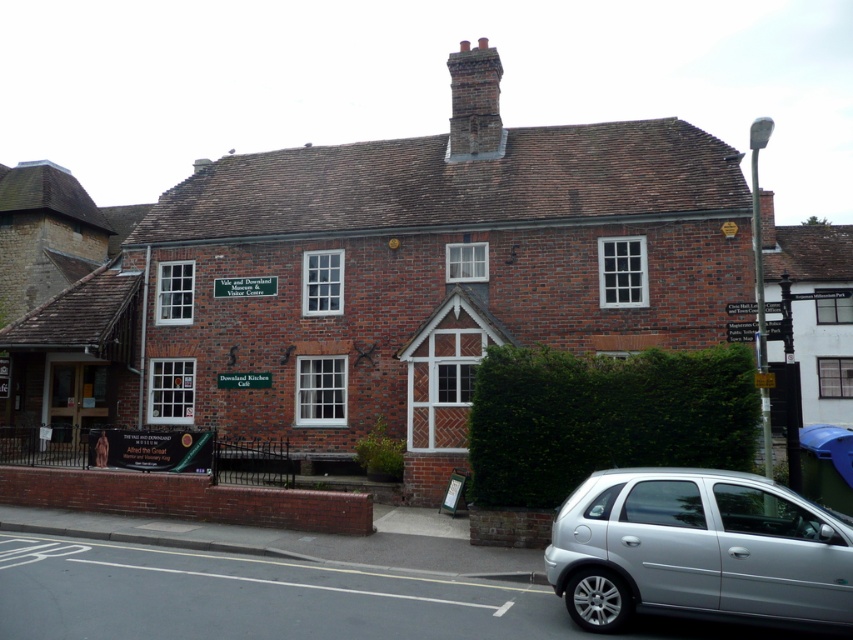
Question: Which point is closer to the camera?

Choices:
 (A) silver metallic hatchback at lower right
 (B) green leafy hedge at lower right

Answer: (A)

Question: Is the position of silver metallic hatchback at lower right less distant than that of green leafy hedge at lower right?

Choices:
 (A) no
 (B) yes

Answer: (B)

Question: Does green leafy hedge at lower right have a lesser width compared to brick chimney at upper center?

Choices:
 (A) yes
 (B) no

Answer: (A)

Question: Does silver metallic hatchback at lower right appear on the right side of green leafy hedge at lower right?

Choices:
 (A) yes
 (B) no

Answer: (B)

Question: Which object is the closest to the brick chimney at upper center?

Choices:
 (A) green leafy hedge at lower right
 (B) silver metallic hatchback at lower right

Answer: (A)

Question: Which is farther from the green leafy hedge at lower right?

Choices:
 (A) silver metallic hatchback at lower right
 (B) brick chimney at upper center

Answer: (B)